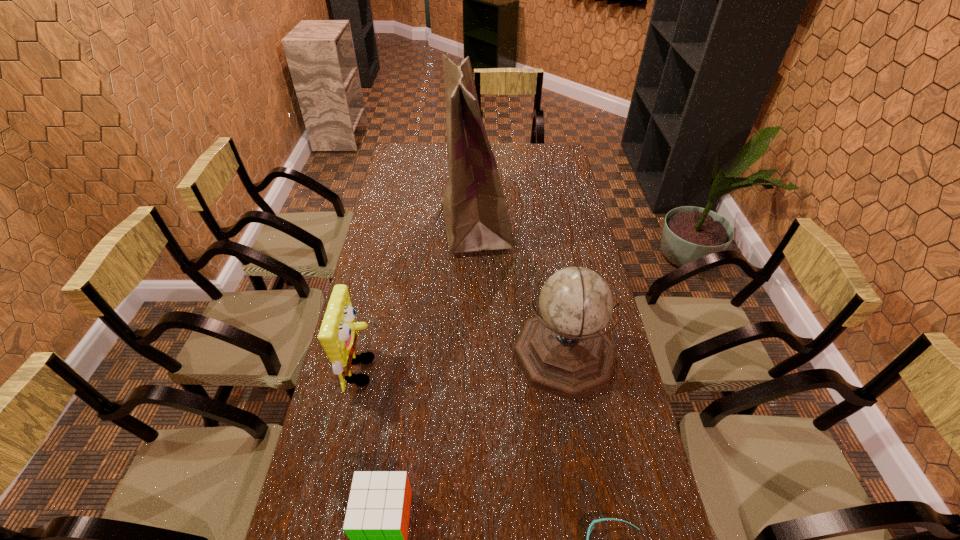
You are a GUI agent. You are given a task and a screenshot of the screen. Output one action in this format:
    pyautogui.click(x=<x>, y=<y>)
    Task: Click on the farthest object
    The height and width of the screenshot is (540, 960).
    Given the screenshot: What is the action you would take?
    coord(476,217)

At what (x,y) coordinates should I click in order to perform the action: click on grocery bag. Please return your answer as a coordinate pair (x, y). The width and height of the screenshot is (960, 540). Looking at the image, I should click on (476, 217).

In order to click on globe in this screenshot , I will do `click(564, 351)`.

Locate an element on the screen. the leftmost object is located at coordinates (338, 336).

What are the coordinates of `sponge` in the screenshot? It's located at (338, 336).

Find the location of a particular element. free space located on the front-facing side of the farthest object is located at coordinates (550, 223).

Where is `vacant space located 0.300m on the surface of the fourth shortest object`? vacant space located 0.300m on the surface of the fourth shortest object is located at coordinates (413, 355).

Locate an element on the screen. Image resolution: width=960 pixels, height=540 pixels. vacant space located on the surface of the fourth shortest object is located at coordinates (393, 355).

I want to click on vacant area situated on the surface of the fourth shortest object, so click(x=490, y=355).

Identify the location of free space located on the face of the leftmost object. click(511, 370).